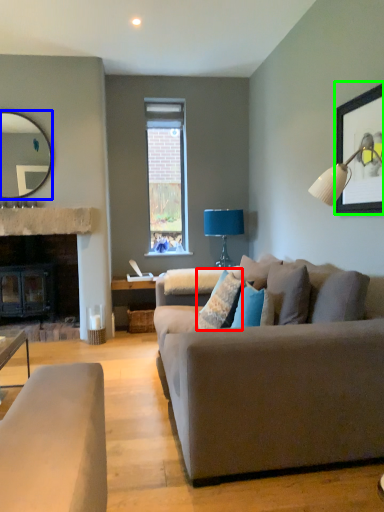
Question: Based on their relative distances, which object is nearer to pillow (highlighted by a red box)? Choose from mirror (highlighted by a blue box) and picture frame (highlighted by a green box).

Choices:
 (A) mirror
 (B) picture frame

Answer: (B)